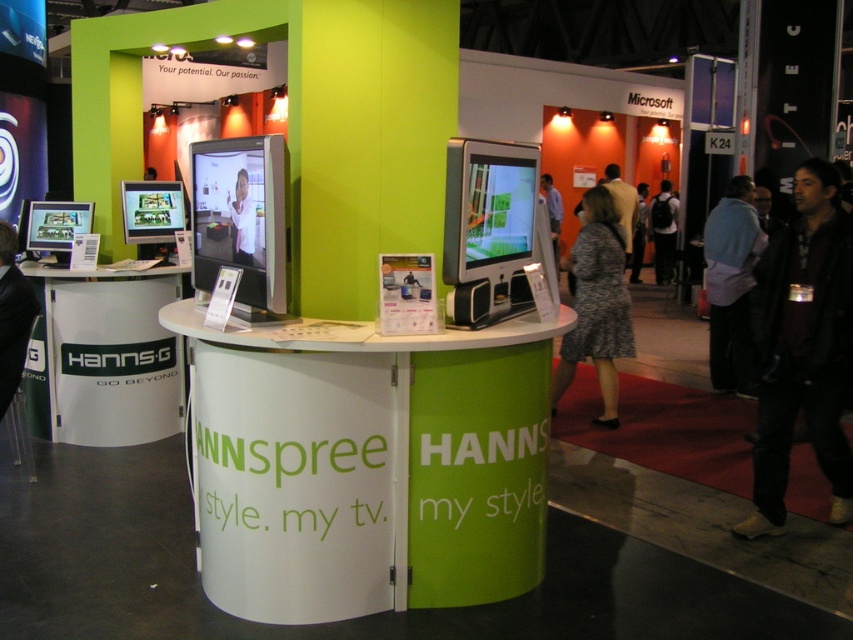
You are a photographer at the HannsG booth and need to capture both the dark brown leather jacket at lower right and the patterned fabric dress at center in a single shot. However, you can only focus on one object at a time. Which object should you focus on to ensure the other remains in the background?

You should focus on the dark brown leather jacket at lower right because it is in front of the patterned fabric dress at center, so if you focus on it, the dress will naturally be in the background.